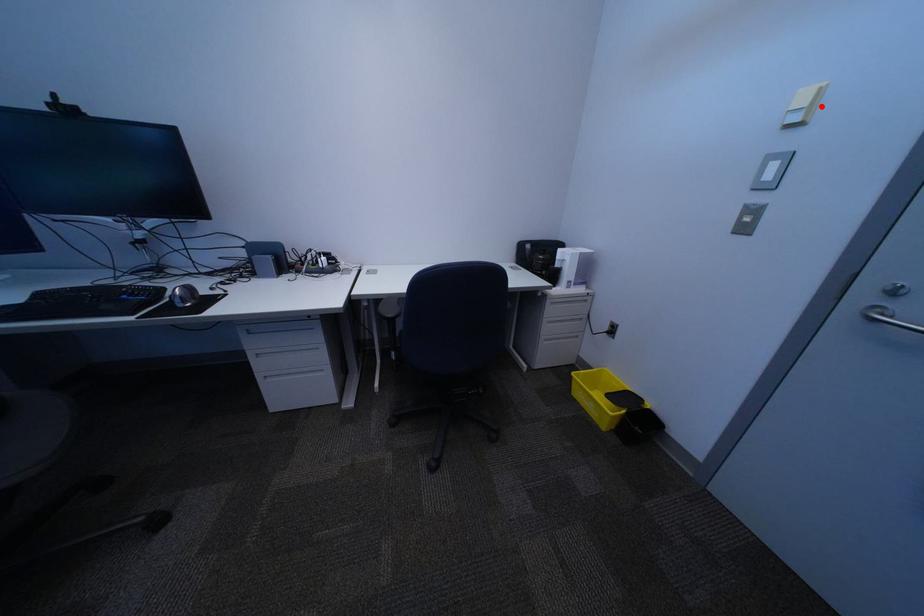
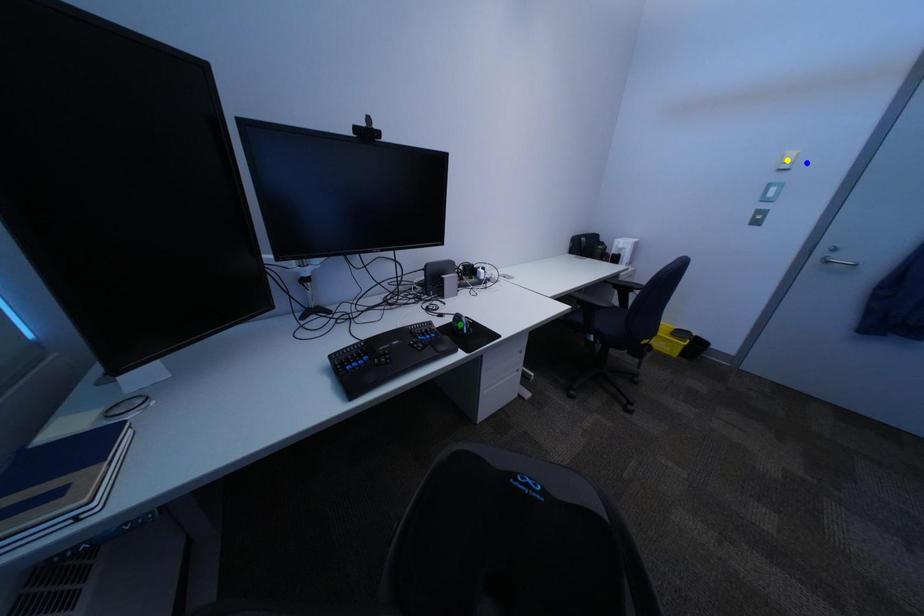
Question: I am providing you with two images of the same scene from different viewpoints. A red point is marked on the first image. You are given multiple points on the second image. Which point in image 2 is actually the same real-world point as the red point in image 1?

Choices:
 (A) green point
 (B) yellow point
 (C) blue point

Answer: (C)